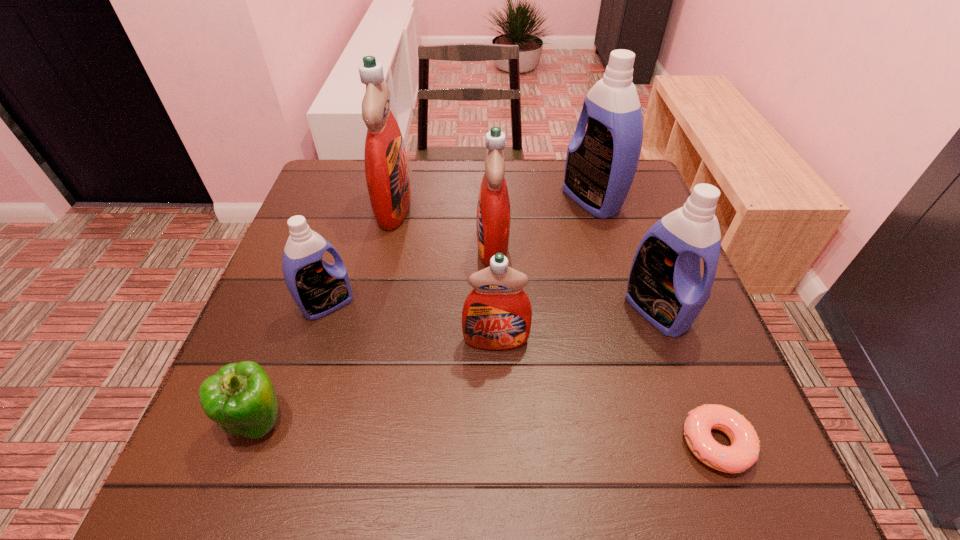
This screenshot has height=540, width=960. I want to click on the biggest red detergent, so click(386, 167).

Identify the location of the farthest blue detergent. This screenshot has height=540, width=960. (601, 163).

The image size is (960, 540). Find the location of `the second biggest red detergent`. the second biggest red detergent is located at coordinates (493, 208).

Locate an element on the screen. the second biggest blue detergent is located at coordinates (665, 286).

Locate an element on the screen. the leftmost blue detergent is located at coordinates (318, 288).

Find the location of a particular element. The image size is (960, 540). the smallest red detergent is located at coordinates (497, 314).

You are a GUI agent. You are given a task and a screenshot of the screen. Output one action in this format:
    pyautogui.click(x=<x>, y=<y>)
    Task: Click on the bell pepper
    This screenshot has width=960, height=540.
    Given the screenshot: What is the action you would take?
    pyautogui.click(x=240, y=397)

You are a GUI agent. You are given a task and a screenshot of the screen. Output one action in this format:
    pyautogui.click(x=<x>, y=<y>)
    Task: Click on the green bell pepper
    
    Given the screenshot: What is the action you would take?
    pyautogui.click(x=240, y=397)

Image resolution: width=960 pixels, height=540 pixels. I want to click on pink doughnut, so click(x=744, y=451).

Where is `the shortest object`? The width and height of the screenshot is (960, 540). the shortest object is located at coordinates (744, 451).